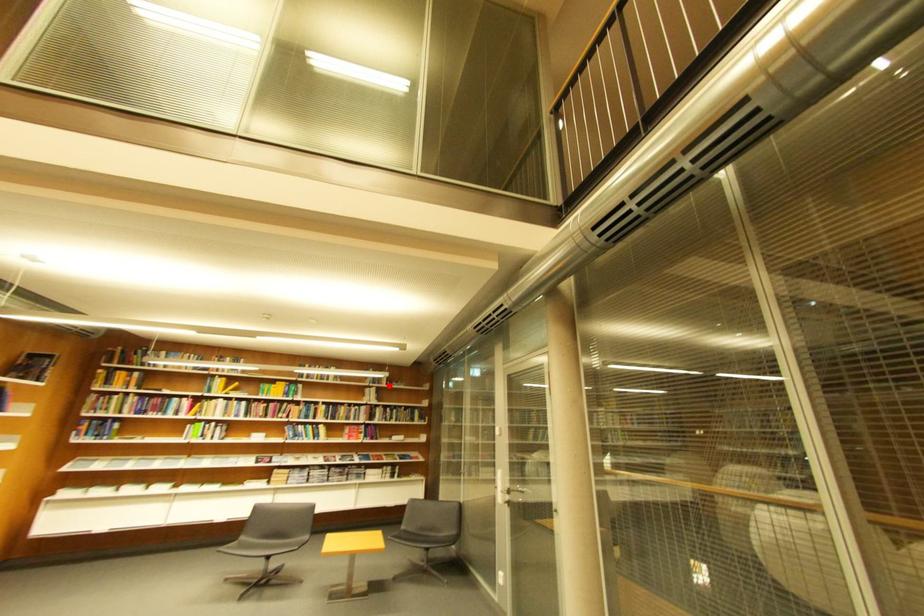
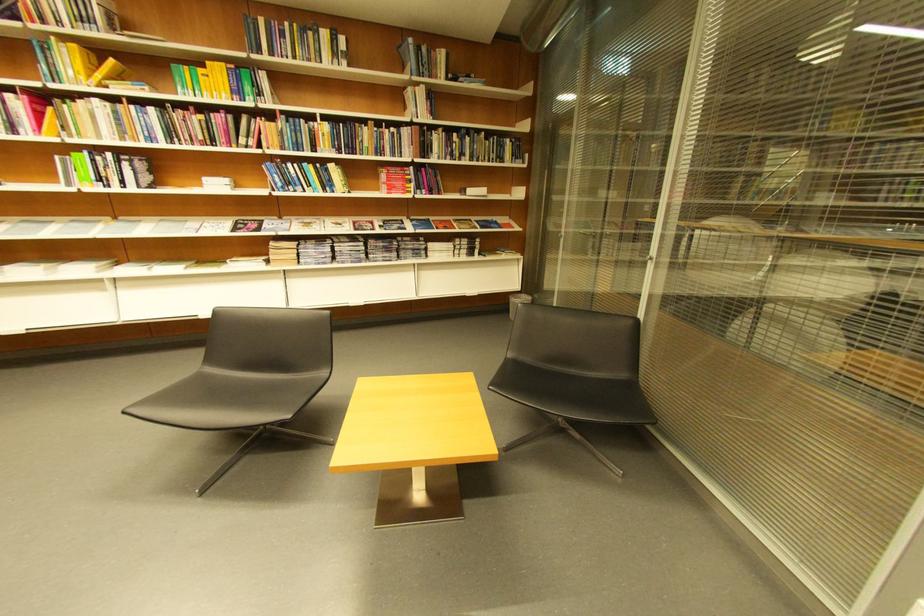
Question: I am providing you with two images of the same scene from different viewpoints. Image1 has a red point marked. In image2, the corresponding 3D location appears at what relative position? Reply with the corresponding letter.

Choices:
 (A) Closer
 (B) Farther

Answer: (A)